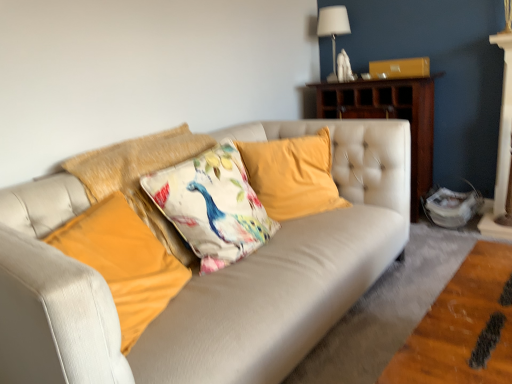
Question: Based on their positions, is velvet yellow pillow at center, arranged as the first pillow when viewed from the right, located to the left or right of velvet orange pillow at center, which ranks as the 4th pillow in right-to-left order?

Choices:
 (A) right
 (B) left

Answer: (A)

Question: In the image, is velvet yellow pillow at center, which is the fourth pillow from left to right, positioned in front of or behind velvet orange pillow at center, the 1th pillow positioned from the left?

Choices:
 (A) behind
 (B) front

Answer: (A)

Question: Estimate the real-world distances between objects in this image. Which object is farther from the velvet orange pillow at center, the 1th pillow positioned from the left?

Choices:
 (A) velvet yellow pillow at center, arranged as the first pillow when viewed from the right
 (B) white fabric lampshade at upper right
 (C) floral fabric cushion at center, marked as the third pillow in a right-to-left arrangement
 (D) wooden cabinet at upper right
 (E) floral fabric cushion at center, which is the 2th pillow from right to left

Answer: (B)

Question: Considering the real-world distances, which object is closest to the velvet orange pillow at center, which ranks as the 4th pillow in right-to-left order?

Choices:
 (A) floral fabric cushion at center, marked as the third pillow in a right-to-left arrangement
 (B) floral fabric cushion at center, which is the 2th pillow from right to left
 (C) velvet yellow pillow at center, which is the fourth pillow from left to right
 (D) white fabric lampshade at upper right
 (E) wooden cabinet at upper right

Answer: (A)